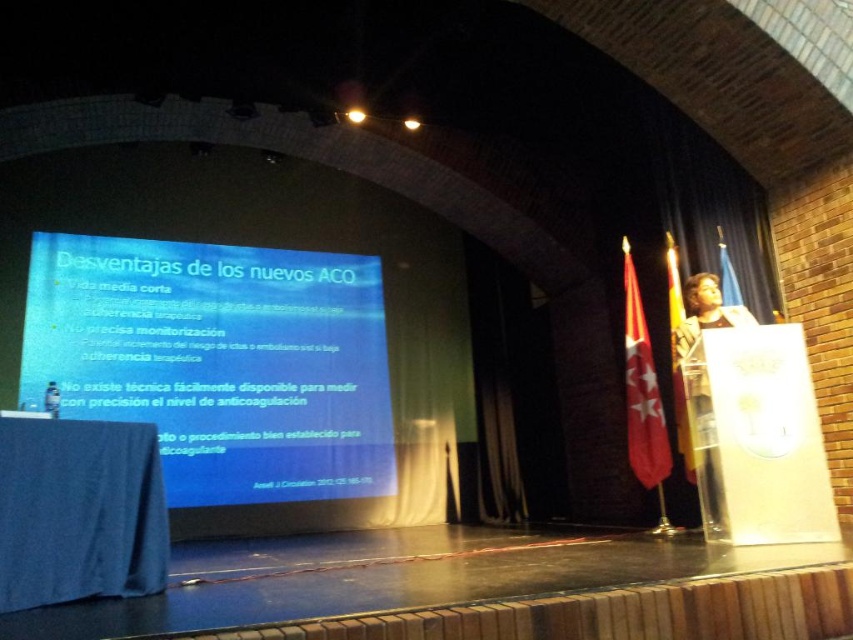
Question: Among these objects, which one is nearest to the camera?

Choices:
 (A) blue glossy projector screen at center
 (B) dark brown leather jacket at right

Answer: (B)

Question: Is blue glossy projector screen at center smaller than dark brown leather jacket at right?

Choices:
 (A) yes
 (B) no

Answer: (B)

Question: Can you confirm if blue glossy projector screen at center is smaller than dark brown leather jacket at right?

Choices:
 (A) no
 (B) yes

Answer: (A)

Question: Does blue glossy projector screen at center appear over dark brown leather jacket at right?

Choices:
 (A) no
 (B) yes

Answer: (B)